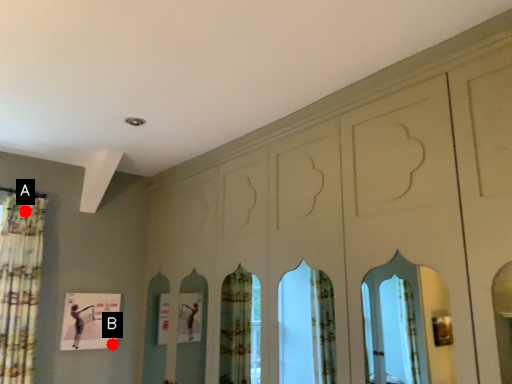
Question: Two points are circled on the image, labeled by A and B beside each circle. Which of the following is the closest to the observer?

Choices:
 (A) A is closer
 (B) B is closer

Answer: (A)